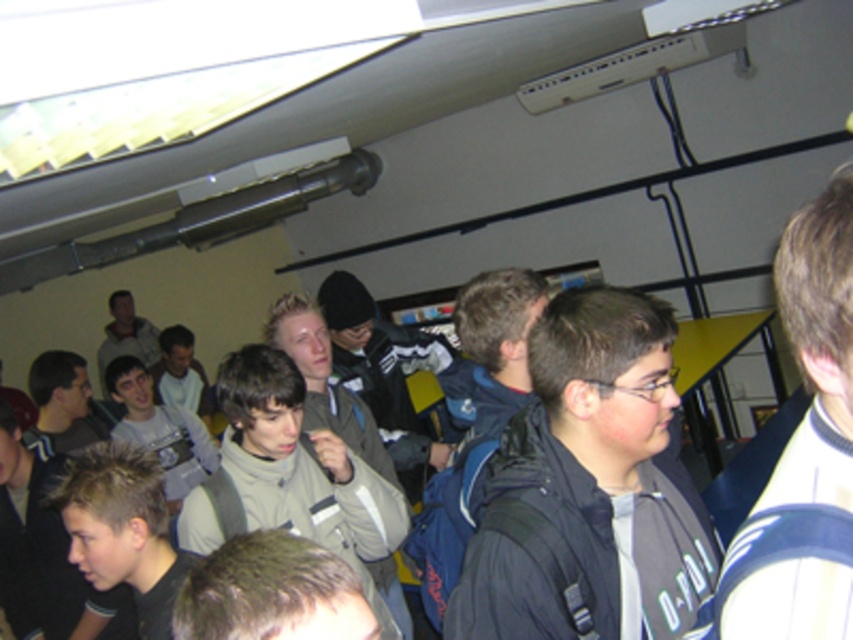
Question: Does dark gray jacket at center have a greater width compared to dark brown hair at center?

Choices:
 (A) yes
 (B) no

Answer: (A)

Question: Which object is closer to the camera taking this photo?

Choices:
 (A) dark gray jacket at center
 (B) light gray jacket at center

Answer: (A)

Question: Does dark brown hair at center appear on the left side of gray matte jacket at center?

Choices:
 (A) yes
 (B) no

Answer: (B)

Question: Is gray matte jacket at center below light gray jacket at center?

Choices:
 (A) no
 (B) yes

Answer: (B)

Question: Which object is farther from the camera taking this photo?

Choices:
 (A) dark gray jacket at center
 (B) gray matte jacket at center

Answer: (B)

Question: Considering the real-world distances, which object is farthest from the light gray jacket at center?

Choices:
 (A) dark gray jacket at center
 (B) spiky hair at center
 (C) gray matte jacket at center

Answer: (A)